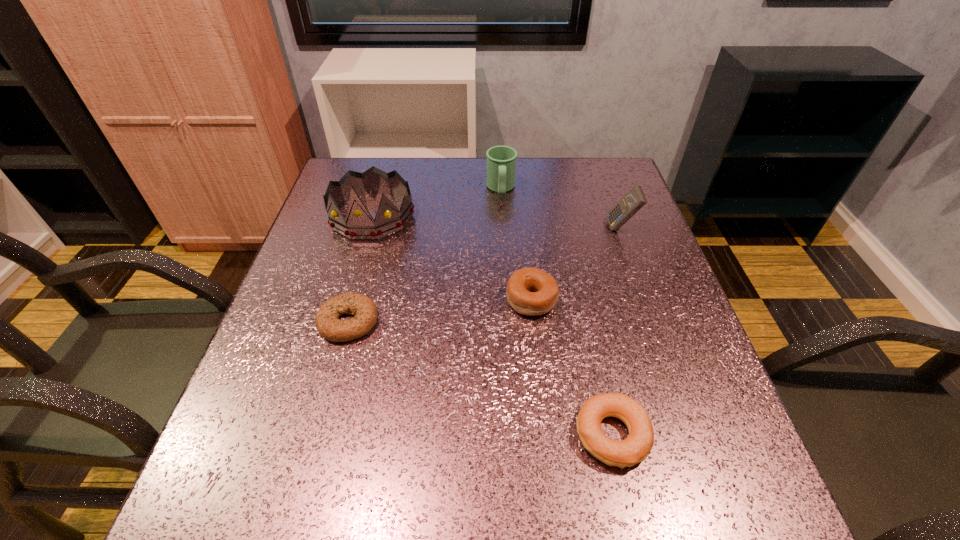
Where is `tiara`? The image size is (960, 540). tiara is located at coordinates (359, 225).

Identify the location of calculator. Image resolution: width=960 pixels, height=540 pixels. (634, 200).

What are the coordinates of `mug` in the screenshot? It's located at (501, 160).

Where is `the tallest bagel`? This screenshot has width=960, height=540. the tallest bagel is located at coordinates (530, 291).

At what (x,y) coordinates should I click in order to perform the action: click on the nearest object. Please return your answer as a coordinate pair (x, y). The height and width of the screenshot is (540, 960). Looking at the image, I should click on (634, 449).

Where is `the leftmost bagel`? This screenshot has height=540, width=960. the leftmost bagel is located at coordinates (364, 310).

Identify the location of vacant space located 0.110m at the front of the tallest object with jewels. (355, 276).

Where is `blank space located on the front-facing side of the rightmost object`? The height and width of the screenshot is (540, 960). blank space located on the front-facing side of the rightmost object is located at coordinates (492, 227).

Where is `blank space located on the front-facing side of the rightmost object`? blank space located on the front-facing side of the rightmost object is located at coordinates (452, 227).

Image resolution: width=960 pixels, height=540 pixels. I want to click on blank space located on the front-facing side of the rightmost object, so click(x=556, y=227).